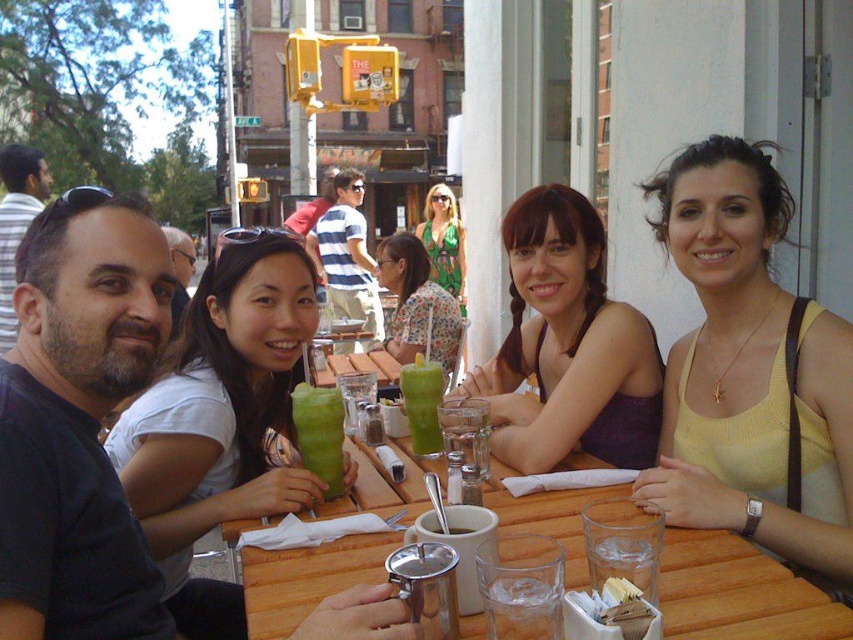
You are standing at the entrance of the outdoor cafe and want to locate the striped cotton shirt at center. According to the coordinates given, where would you look to find it?

The striped cotton shirt at center is located at coordinates point (346, 256).